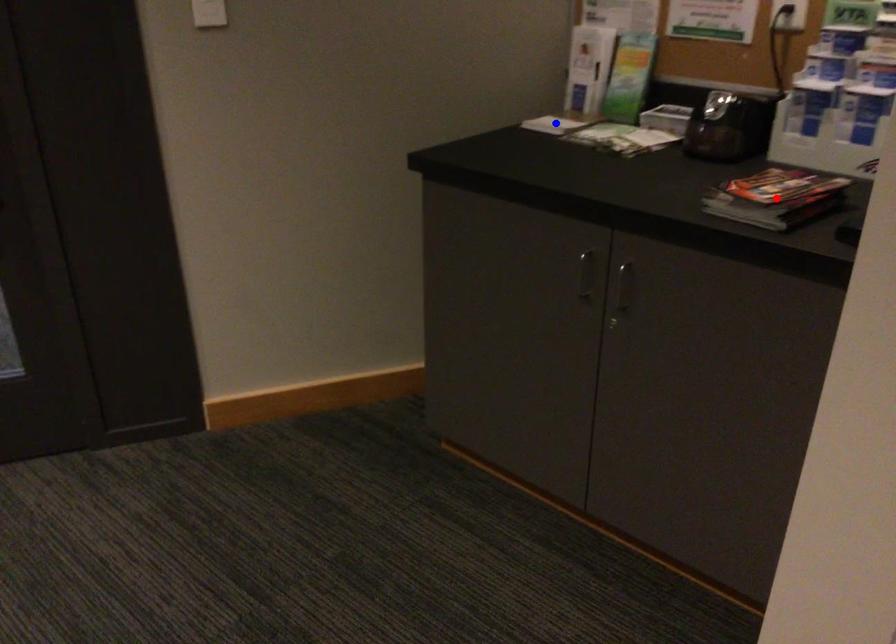
Question: Two points are marked on the image. Which point is closer to the camera?

Choices:
 (A) Blue point is closer.
 (B) Red point is closer.

Answer: (B)